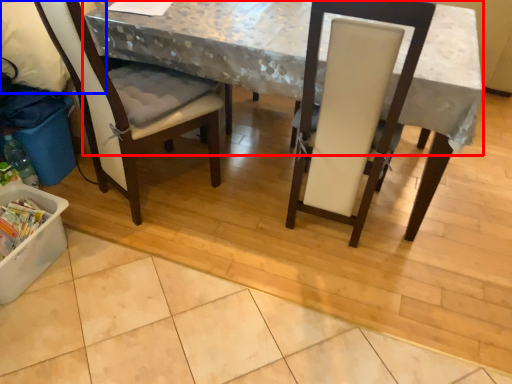
Question: Among these objects, which one is farthest to the camera, table (highlighted by a red box) or leftover (highlighted by a blue box)?

Choices:
 (A) table
 (B) leftover

Answer: (B)